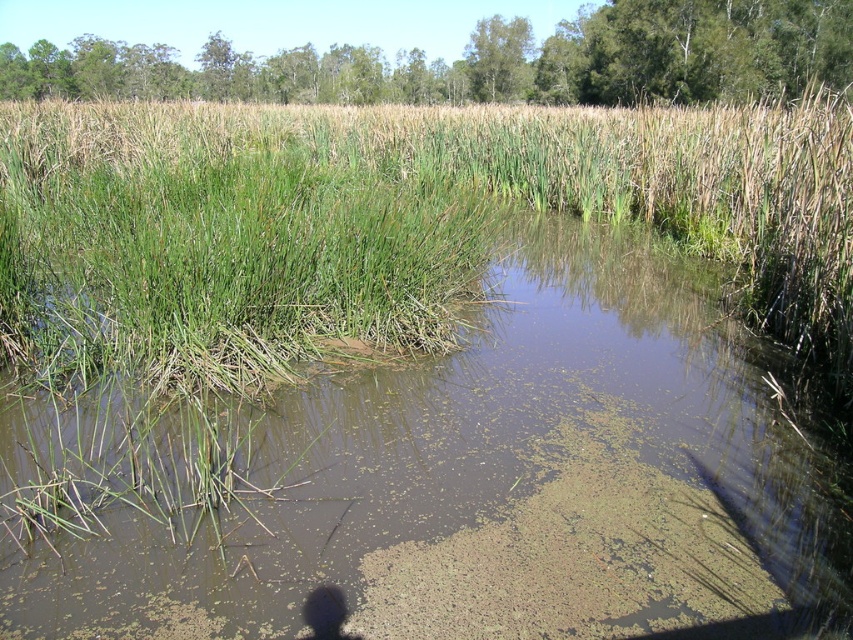
Question: Which of the following is the closest to the observer?

Choices:
 (A) (505, 115)
 (B) (564, 444)

Answer: (B)

Question: Does brown murky water at center have a smaller size compared to green grass at center?

Choices:
 (A) yes
 (B) no

Answer: (A)

Question: Is brown murky water at center wider than green grass at center?

Choices:
 (A) no
 (B) yes

Answer: (A)

Question: Does brown murky water at center have a larger size compared to green grass at center?

Choices:
 (A) yes
 (B) no

Answer: (B)